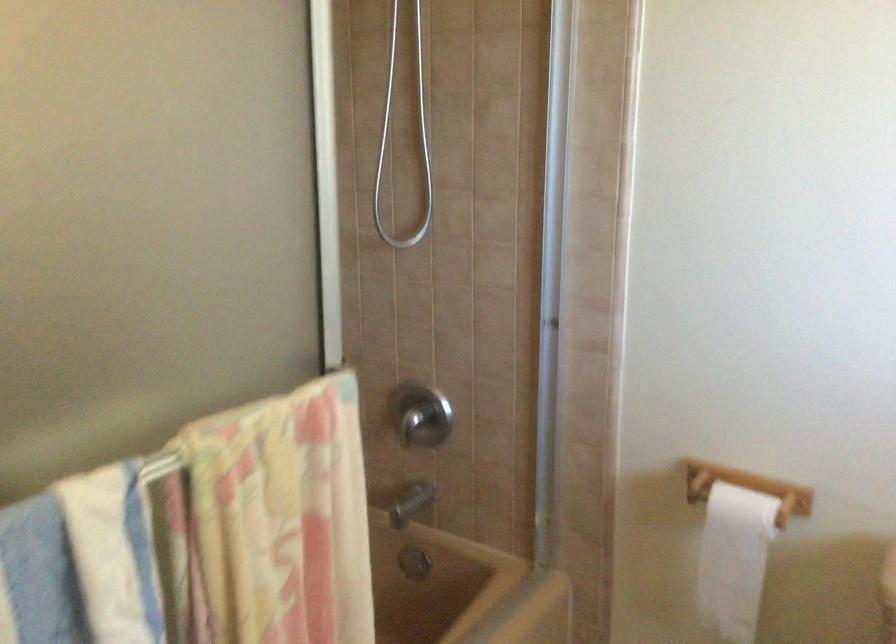
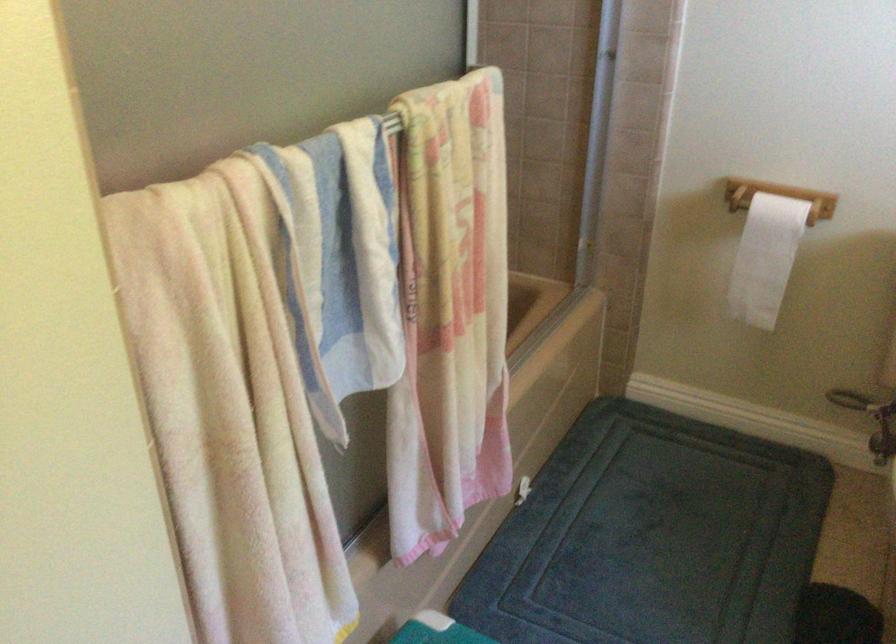
Locate, in the second image, the point that corresponds to point 737,563 in the first image.

(764, 258)